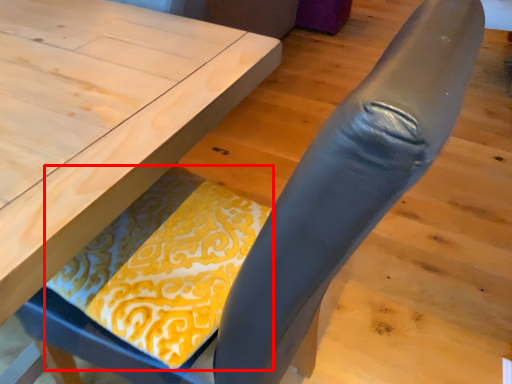
Question: Observing the image, what is the correct spatial positioning of blanket (annotated by the red box) in reference to table?

Choices:
 (A) right
 (B) left

Answer: (A)